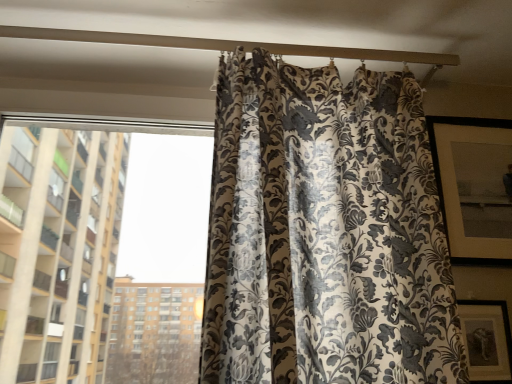
What do you see at coordinates (227, 45) in the screenshot? I see `white matte beam at upper center` at bounding box center [227, 45].

At what (x,y) coordinates should I click in order to perform the action: click on silky floral-patterned curtain at center. Please return your answer as a coordinate pair (x, y). This screenshot has width=512, height=384. Looking at the image, I should click on (325, 232).

I want to click on silky floral curtain at right, so click(474, 184).

Image resolution: width=512 pixels, height=384 pixels. In order to click on white matte beam at upper center in this screenshot , I will do `click(227, 45)`.

You are a GUI agent. You are given a task and a screenshot of the screen. Output one action in this format:
    pyautogui.click(x=<x>, y=<y>)
    Task: Click on the curtain below the silky floral curtain at right (from the image's perspective)
    This screenshot has width=512, height=384.
    Given the screenshot: What is the action you would take?
    [325, 232]

Do you think silky floral-patterned curtain at center is within silky floral curtain at right, or outside of it?

silky floral-patterned curtain at center is located beyond the bounds of silky floral curtain at right.

Which object is positioned more to the left, silky floral-patterned curtain at center or silky floral curtain at right?

silky floral-patterned curtain at center.

Considering the positions of objects silky floral-patterned curtain at center and silky floral curtain at right in the image provided, who is behind, silky floral-patterned curtain at center or silky floral curtain at right?

silky floral curtain at right is behind.

Considering the sizes of objects silky floral curtain at right and silky floral-patterned curtain at center in the image provided, who is bigger, silky floral curtain at right or silky floral-patterned curtain at center?

With larger size is silky floral-patterned curtain at center.

Is silky floral curtain at right positioned beyond the bounds of silky floral-patterned curtain at center?

Yes, silky floral curtain at right is outside of silky floral-patterned curtain at center.

Is silky floral curtain at right in front of silky floral-patterned curtain at center?

No, it is not.

From a real-world perspective, relative to silky floral-patterned curtain at center, is silky floral curtain at right vertically above or below?

In terms of real-world spatial position, silky floral curtain at right is above silky floral-patterned curtain at center.

Between white matte beam at upper center and silky floral-patterned curtain at center, which one has smaller size?

white matte beam at upper center.

Where is `beam located above the silky floral-patterned curtain at center (from the image's perspective)`? beam located above the silky floral-patterned curtain at center (from the image's perspective) is located at coordinates (227, 45).

From a real-world perspective, is white matte beam at upper center positioned above or below silky floral-patterned curtain at center?

From a real-world perspective, white matte beam at upper center is physically above silky floral-patterned curtain at center.

Considering the positions of points (179, 47) and (332, 164), is point (179, 47) closer to camera compared to point (332, 164)?

That is False.

Does point (208, 43) appear closer or farther from the camera than point (504, 257)?

Point (208, 43) is farther from the camera than point (504, 257).

Which is correct: white matte beam at upper center is inside silky floral curtain at right, or outside of it?

white matte beam at upper center is outside silky floral curtain at right.

Consider the image. Is there a large distance between white matte beam at upper center and silky floral curtain at right?

No, white matte beam at upper center is not far away from silky floral curtain at right.

Looking at this image, is white matte beam at upper center at the left side of silky floral curtain at right?

Indeed, white matte beam at upper center is positioned on the left side of silky floral curtain at right.

Between matte black picture frame at lower right and white matte beam at upper center, which one has less height?

With less height is white matte beam at upper center.

Which of these two, matte black picture frame at lower right or white matte beam at upper center, is bigger?

Bigger between the two is white matte beam at upper center.

How many degrees apart are the facing directions of matte black picture frame at lower right and white matte beam at upper center?

4.46 degrees.

How much distance is there between matte black picture frame at lower right and white matte beam at upper center?

matte black picture frame at lower right is 31.59 inches from white matte beam at upper center.

Is silky floral-patterned curtain at center bigger than matte black picture frame at lower right?

Yes.

Would you say silky floral-patterned curtain at center is outside matte black picture frame at lower right?

Yes.

Is silky floral-patterned curtain at center oriented towards matte black picture frame at lower right?

No, silky floral-patterned curtain at center is not oriented towards matte black picture frame at lower right.

From a real-world perspective, is silky floral-patterned curtain at center under matte black picture frame at lower right?

No.

How many degrees apart are the facing directions of matte black picture frame at lower right and silky floral curtain at right?

The facing directions of matte black picture frame at lower right and silky floral curtain at right are 4.52 degrees apart.

Is matte black picture frame at lower right bigger or smaller than silky floral curtain at right?

Considering their sizes, matte black picture frame at lower right takes up less space than silky floral curtain at right.

Image resolution: width=512 pixels, height=384 pixels. Find the location of `picture frame on the left of silky floral curtain at right`. picture frame on the left of silky floral curtain at right is located at coordinates coord(487,340).

This screenshot has width=512, height=384. Find the location of `window screen on the right of the silky floral-patterned curtain at center`. window screen on the right of the silky floral-patterned curtain at center is located at coordinates (474, 184).

I want to click on window screen behind the silky floral-patterned curtain at center, so click(474, 184).

From the image, which object appears to be nearer to matte black picture frame at lower right, silky floral curtain at right or white matte beam at upper center?

silky floral curtain at right.

When comparing their distances from matte black picture frame at lower right, does white matte beam at upper center or silky floral curtain at right seem closer?

silky floral curtain at right is closer to matte black picture frame at lower right.

In the scene shown: Looking at the image, which one is located closer to silky floral-patterned curtain at center, matte black picture frame at lower right or silky floral curtain at right?

Based on the image, silky floral curtain at right appears to be nearer to silky floral-patterned curtain at center.

Considering their positions, is silky floral curtain at right positioned further to silky floral-patterned curtain at center than white matte beam at upper center?

white matte beam at upper center is positioned further to the anchor silky floral-patterned curtain at center.

Estimate the real-world distances between objects in this image. Which object is closer to silky floral-patterned curtain at center, white matte beam at upper center or silky floral curtain at right?

silky floral curtain at right.

Considering their positions, is white matte beam at upper center positioned further to silky floral curtain at right than matte black picture frame at lower right?

Among the two, white matte beam at upper center is located further to silky floral curtain at right.

Looking at the image, which one is located closer to white matte beam at upper center, silky floral curtain at right or silky floral-patterned curtain at center?

Based on the image, silky floral curtain at right appears to be nearer to white matte beam at upper center.

Estimate the real-world distances between objects in this image. Which object is further from white matte beam at upper center, silky floral-patterned curtain at center or silky floral curtain at right?

silky floral-patterned curtain at center is positioned further to the anchor white matte beam at upper center.

Find the location of `curtain between white matte beam at upper center and silky floral curtain at right`. curtain between white matte beam at upper center and silky floral curtain at right is located at coordinates (325, 232).

The width and height of the screenshot is (512, 384). I want to click on picture frame situated between white matte beam at upper center and silky floral curtain at right from left to right, so click(x=487, y=340).

Identify the location of picture frame between silky floral-patterned curtain at center and silky floral curtain at right from left to right. (487, 340).

The image size is (512, 384). I want to click on curtain between white matte beam at upper center and matte black picture frame at lower right in the vertical direction, so click(325, 232).